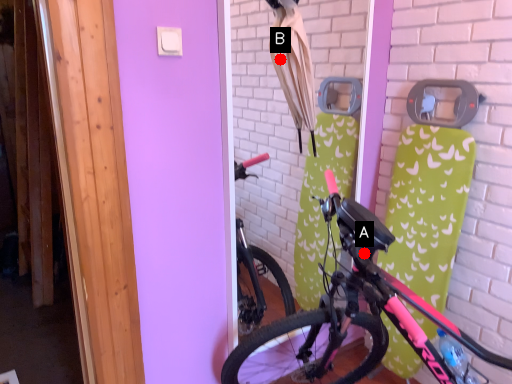
Question: Two points are circled on the image, labeled by A and B beside each circle. Which point is farther from the camera taking this photo?

Choices:
 (A) A is further
 (B) B is further

Answer: (B)